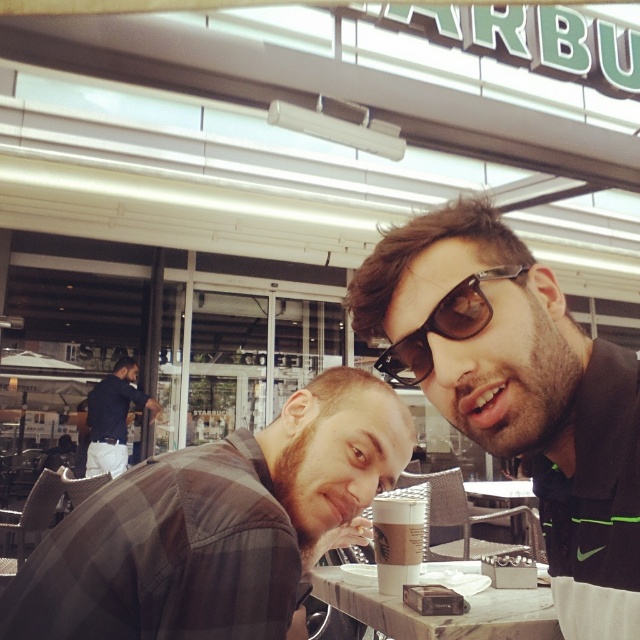
Question: Can you confirm if sunglasses at upper right is positioned above white paper cup at center?

Choices:
 (A) yes
 (B) no

Answer: (A)

Question: Does brown plaid shirt at center appear on the left side of marble-patterned table at center?

Choices:
 (A) no
 (B) yes

Answer: (B)

Question: Can you confirm if sunglasses at center is smaller than white paper cup at center?

Choices:
 (A) yes
 (B) no

Answer: (B)

Question: Which of these objects is positioned closest to the white paper cup at center?

Choices:
 (A) sunglasses at upper right
 (B) brown plaid shirt at center
 (C) sunglasses at center

Answer: (A)

Question: Which point is farther to the camera?

Choices:
 (A) sunglasses at upper right
 (B) brown plaid shirt at center
 (C) white paper cup at center

Answer: (C)

Question: Which of the following is the closest to the observer?

Choices:
 (A) marble-patterned table at center
 (B) dark blue shirt at center
 (C) sunglasses at center

Answer: (C)